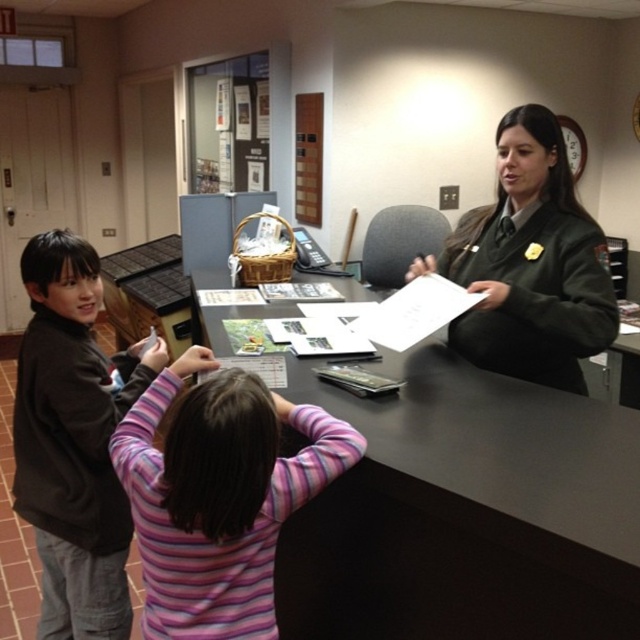
Question: Which object appears farthest from the camera in this image?

Choices:
 (A) green uniform at center
 (B) striped sweater at center
 (C) black matte table at center
 (D) brown soft sweater at left

Answer: (A)

Question: Does black matte table at center come in front of brown soft sweater at left?

Choices:
 (A) yes
 (B) no

Answer: (A)

Question: Is black matte table at center positioned in front of brown soft sweater at left?

Choices:
 (A) no
 (B) yes

Answer: (B)

Question: Which object is positioned closest to the striped sweater at center?

Choices:
 (A) black matte table at center
 (B) green uniform at center
 (C) brown soft sweater at left

Answer: (A)

Question: Is black matte table at center below striped sweater at center?

Choices:
 (A) no
 (B) yes

Answer: (A)

Question: Estimate the real-world distances between objects in this image. Which object is farther from the striped sweater at center?

Choices:
 (A) green uniform at center
 (B) brown soft sweater at left
 (C) black matte table at center

Answer: (A)